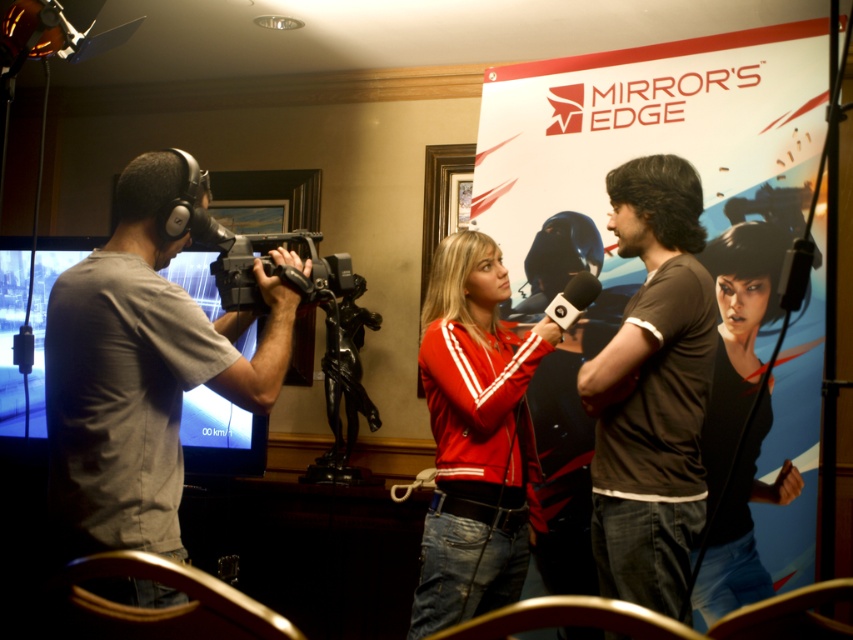
Question: Based on their relative distances, which object is farther from the red matte jacket at center?

Choices:
 (A) black plastic video camera at center
 (B) black matte jacket at center
 (C) brown cotton t-shirt at center

Answer: (B)

Question: Which of the following is the closest to the observer?

Choices:
 (A) (492, 593)
 (B) (657, 524)
 (C) (728, 372)
 (D) (268, 362)

Answer: (D)

Question: Can you confirm if gray fabric shirt at left is wider than black plastic video camera at center?

Choices:
 (A) yes
 (B) no

Answer: (A)

Question: Does gray fabric shirt at left appear on the left side of black plastic video camera at center?

Choices:
 (A) no
 (B) yes

Answer: (B)

Question: Which point is farther to the camera?

Choices:
 (A) (346, 289)
 (B) (148, 396)
 (C) (608, 508)
 (D) (469, 524)

Answer: (D)

Question: Is brown cotton t-shirt at center above black matte jacket at center?

Choices:
 (A) no
 (B) yes

Answer: (B)